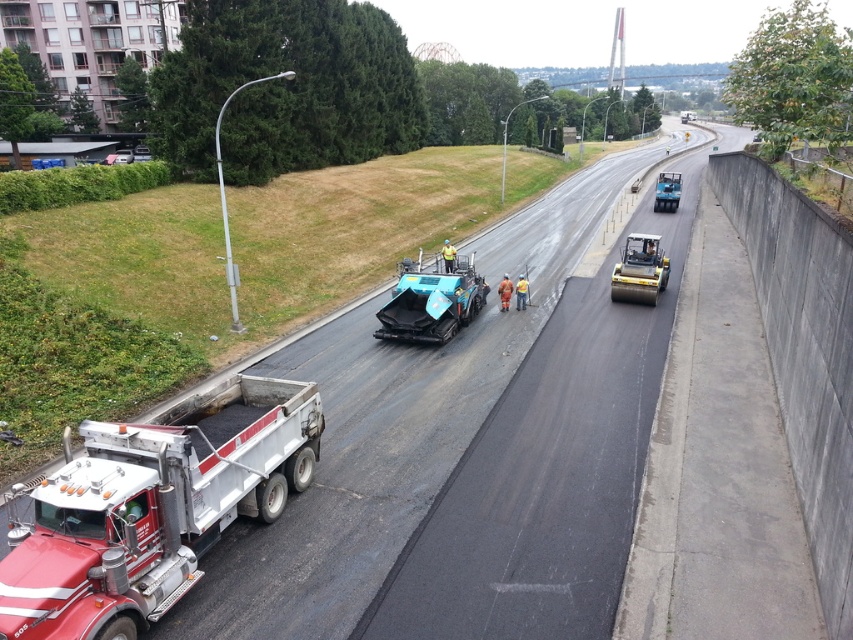
You are a delivery driver who needs to pass through the construction zone. You see the black asphalt road at center and the teal rubber asphalt spreader at center. Which path should you choose to avoid getting stuck?

The black asphalt road at center is wider than the teal rubber asphalt spreader at center, so you should choose the path along the black asphalt road at center to avoid getting stuck.

You are a construction supervisor who needs to ensure safety on the construction site. The red metallic dump truck at lower left is preparing to unload its load. Is the black asphalt road at center far enough away from the dump truck to allow safe unloading operations?

The distance between the black asphalt road at center and the red metallic dump truck at lower left is 8.58 meters. Based on standard safety protocols, this distance is sufficient for safe unloading operations as it allows enough space for the dump truck to maneuver and for workers to operate safely around the area.